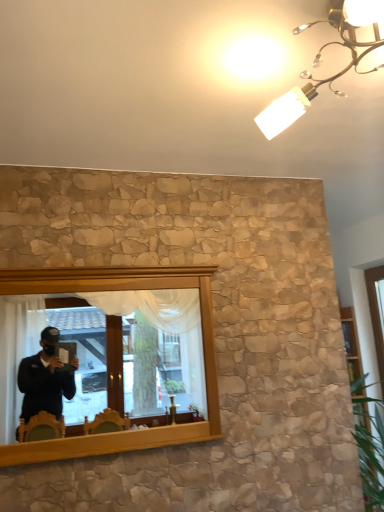
Identify the location of white frosted glass light fixture at upper center. (321, 60).

The height and width of the screenshot is (512, 384). What do you see at coordinates (321, 60) in the screenshot?
I see `white frosted glass light fixture at upper center` at bounding box center [321, 60].

The height and width of the screenshot is (512, 384). What do you see at coordinates (104, 348) in the screenshot?
I see `wooden mirror at center` at bounding box center [104, 348].

You are a GUI agent. You are given a task and a screenshot of the screen. Output one action in this format:
    pyautogui.click(x=<x>, y=<y>)
    Task: Click on the wooden mirror at center
    
    Given the screenshot: What is the action you would take?
    pyautogui.click(x=104, y=348)

The width and height of the screenshot is (384, 512). In order to click on white frosted glass light fixture at upper center in this screenshot , I will do `click(321, 60)`.

Considering the relative positions of white frosted glass light fixture at upper center and wooden mirror at center in the image provided, is white frosted glass light fixture at upper center to the right of wooden mirror at center from the viewer's perspective?

Correct, you'll find white frosted glass light fixture at upper center to the right of wooden mirror at center.

Which object is further away from the camera taking this photo, white frosted glass light fixture at upper center or wooden mirror at center?

wooden mirror at center.

Considering the positions of points (289, 98) and (158, 316), is point (289, 98) farther from camera compared to point (158, 316)?

No, (289, 98) is closer to viewer.

From the image's perspective, is white frosted glass light fixture at upper center under wooden mirror at center?

No, from the image's perspective, white frosted glass light fixture at upper center is not below wooden mirror at center.

From a real-world perspective, between white frosted glass light fixture at upper center and wooden mirror at center, who is vertically higher?

From a 3D spatial view, white frosted glass light fixture at upper center is above.

Considering the relative sizes of white frosted glass light fixture at upper center and wooden mirror at center in the image provided, is white frosted glass light fixture at upper center thinner than wooden mirror at center?

In fact, white frosted glass light fixture at upper center might be wider than wooden mirror at center.

Can you confirm if white frosted glass light fixture at upper center is shorter than wooden mirror at center?

Indeed, white frosted glass light fixture at upper center has a lesser height compared to wooden mirror at center.

Can you confirm if white frosted glass light fixture at upper center is smaller than wooden mirror at center?

No.

Is white frosted glass light fixture at upper center not inside wooden mirror at center?

That's correct, white frosted glass light fixture at upper center is outside of wooden mirror at center.

Is white frosted glass light fixture at upper center positioned far away from wooden mirror at center?

Yes, white frosted glass light fixture at upper center is far from wooden mirror at center.

Is white frosted glass light fixture at upper center oriented away from wooden mirror at center?

No.

Locate an element on the screen. mirror that appears on the left of white frosted glass light fixture at upper center is located at coordinates (104, 348).

Does wooden mirror at center appear on the right side of white frosted glass light fixture at upper center?

In fact, wooden mirror at center is to the left of white frosted glass light fixture at upper center.

Is wooden mirror at center positioned in front of white frosted glass light fixture at upper center?

No, it is behind white frosted glass light fixture at upper center.

Does point (169, 369) come in front of point (300, 90)?

No.

From the image's perspective, would you say wooden mirror at center is shown under white frosted glass light fixture at upper center?

Yes, from the image's perspective, wooden mirror at center is beneath white frosted glass light fixture at upper center.

From a real-world perspective, is wooden mirror at center physically located above or below white frosted glass light fixture at upper center?

wooden mirror at center is situated lower than white frosted glass light fixture at upper center in the real world.

In terms of width, does wooden mirror at center look wider or thinner when compared to white frosted glass light fixture at upper center?

Considering their sizes, wooden mirror at center looks slimmer than white frosted glass light fixture at upper center.

Between wooden mirror at center and white frosted glass light fixture at upper center, which one has less height?

Standing shorter between the two is white frosted glass light fixture at upper center.

Considering the sizes of objects wooden mirror at center and white frosted glass light fixture at upper center in the image provided, who is bigger, wooden mirror at center or white frosted glass light fixture at upper center?

white frosted glass light fixture at upper center is bigger.

Is wooden mirror at center completely or partially outside of white frosted glass light fixture at upper center?

Yes, wooden mirror at center is located beyond the bounds of white frosted glass light fixture at upper center.

Are wooden mirror at center and white frosted glass light fixture at upper center located far from each other?

wooden mirror at center is positioned a significant distance from white frosted glass light fixture at upper center.

Is wooden mirror at center aimed at white frosted glass light fixture at upper center?

Yes, wooden mirror at center is turned towards white frosted glass light fixture at upper center.

What's the angular difference between wooden mirror at center and white frosted glass light fixture at upper center's facing directions?

89.7 degrees.

How distant is wooden mirror at center from white frosted glass light fixture at upper center?

wooden mirror at center and white frosted glass light fixture at upper center are 3.26 meters apart from each other.

This screenshot has height=512, width=384. In order to click on light fixture lying on the right of wooden mirror at center in this screenshot , I will do `click(321, 60)`.

Find the location of a particular element. The image size is (384, 512). light fixture above the wooden mirror at center (from the image's perspective) is located at coordinates (321, 60).

This screenshot has height=512, width=384. In order to click on mirror below the white frosted glass light fixture at upper center (from a real-world perspective) in this screenshot , I will do `click(104, 348)`.